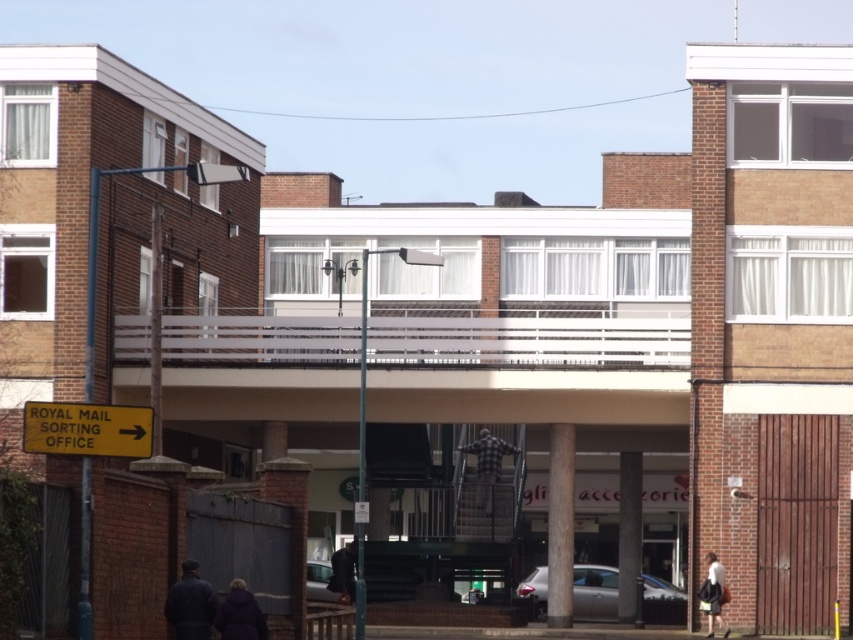
You are a delivery person trying to navigate the street. You see the yellow paper street sign at center and the purple fuzzy coat at lower center. Which object is wider?

The purple fuzzy coat at lower center is wider than the yellow paper street sign at center.

You are a delivery person trying to locate the Royal Mail Sorting Office. You see a yellow paper street sign at center and a smooth concrete pillar at center. Which object is smaller in size?

The yellow paper street sign at center occupies less space than the smooth concrete pillar at center, so the yellow paper street sign at center is smaller in size.